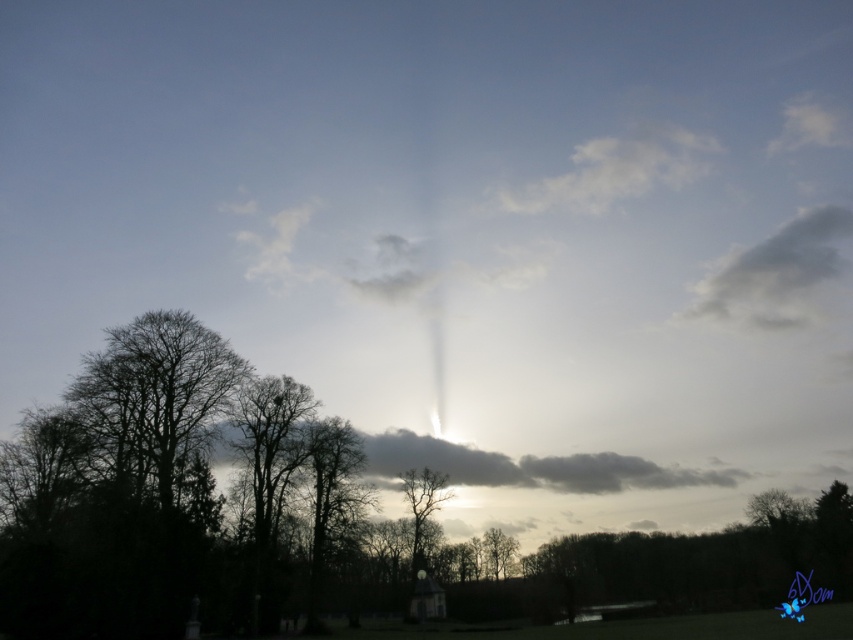
From the picture: You are standing in the serene outdoor scene and want to walk from the point at coordinates point (732,276) to the point at coordinates point (421,502). Which direction should you move relative to your current position?

You should move away from the viewer because point (732,276) is further to the viewer than point (421,502), so moving towards the latter requires going deeper into the scene.

You are standing in the serene outdoor scene and want to walk from the point at coordinates point (703, 600) to the point at coordinates point (184, 445). Since both points are in your line of sight, which point will appear closer to you as you look towards them?

Point (703, 600) is further to the viewer than point (184, 445), so the point at coordinates point (184, 445) will appear closer to you when looking towards them.